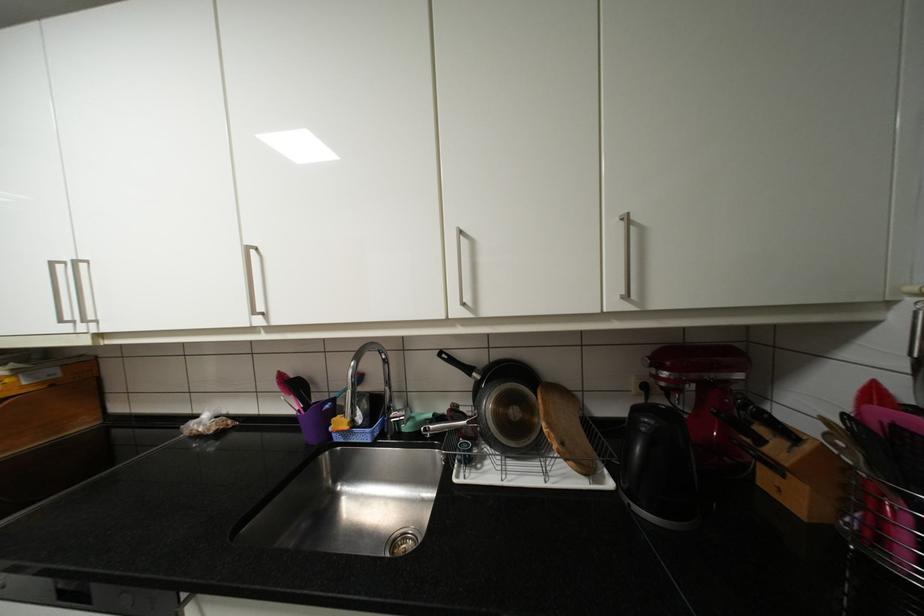
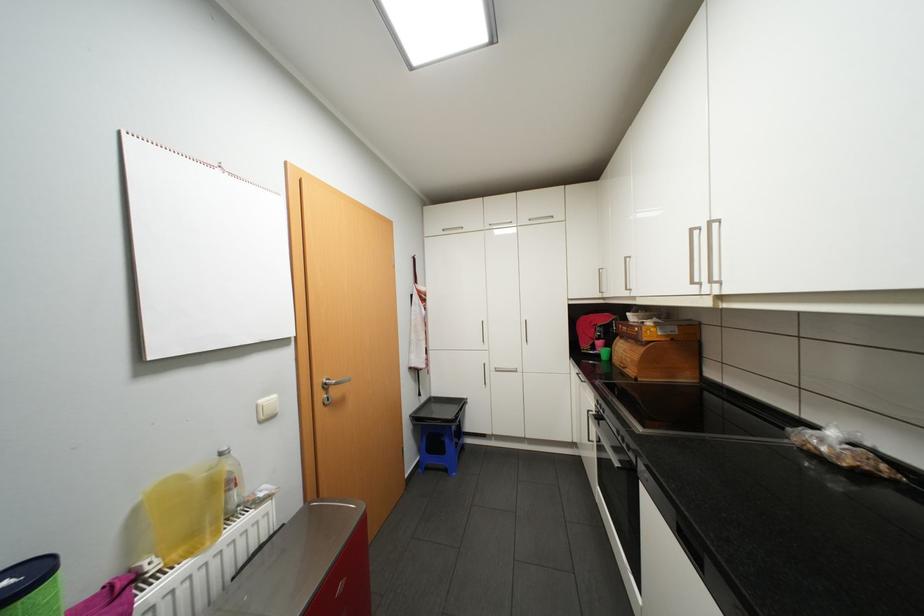
Question: The camera is either moving clockwise (left) or counter-clockwise (right) around the object. The first image is from the beginning of the video and the second image is from the end. Is the camera moving left or right when shooting the video?

Choices:
 (A) Left
 (B) Right

Answer: (B)